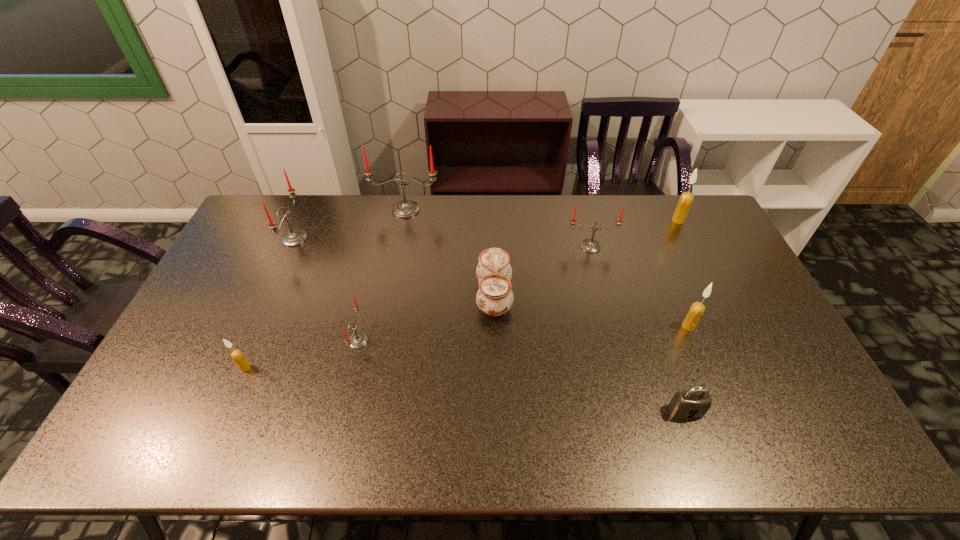
Image resolution: width=960 pixels, height=540 pixels. Identify the location of free spot between the sixth candle from left to right and the tallest object. (547, 268).

At what (x,y) coordinates should I click in order to perform the action: click on unoccupied position between the leftmost red candle and the farthest cream candle. Please return your answer as a coordinate pair (x, y). The image size is (960, 540). Looking at the image, I should click on (486, 230).

I want to click on free space between the farthest cream candle and the nearest cream candle, so click(x=462, y=294).

Identify the location of vacant region between the padlock and the farthest cream candle. (682, 315).

Identify the location of unoccupied position between the fifth object from left to right and the nearest red candle. The width and height of the screenshot is (960, 540). (426, 319).

Identify which object is located as the seventh nearest to the third candle from right to left. Please provide its 2D coordinates. Your answer should be formatted as a tuple, i.e. [(x, y)], where the tuple contains the x and y coordinates of a point satisfying the conditions above.

[(295, 237)]

Locate which object ranks third in proximity to the farthest red candle. Please provide its 2D coordinates. Your answer should be formatted as a tuple, i.e. [(x, y)], where the tuple contains the x and y coordinates of a point satisfying the conditions above.

[(588, 245)]

This screenshot has height=540, width=960. Identify the location of candle that is the third nearest to the second object from right to left. click(x=406, y=208).

Image resolution: width=960 pixels, height=540 pixels. What are the coordinates of `the fourth closest candle to the white chinaware` in the screenshot? It's located at (696, 310).

Image resolution: width=960 pixels, height=540 pixels. Identify the location of the third closest red candle relative to the tallest object. (358, 340).